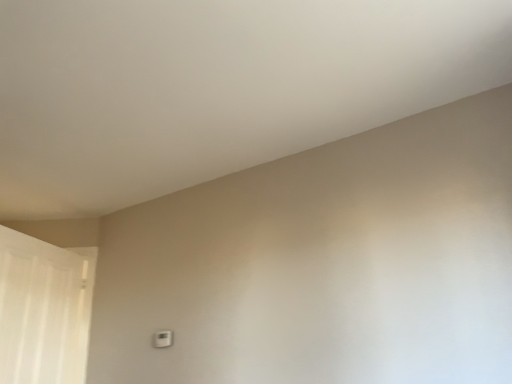
Question: Should I look upward or downward to see white sheer curtain at left?

Choices:
 (A) down
 (B) up

Answer: (A)